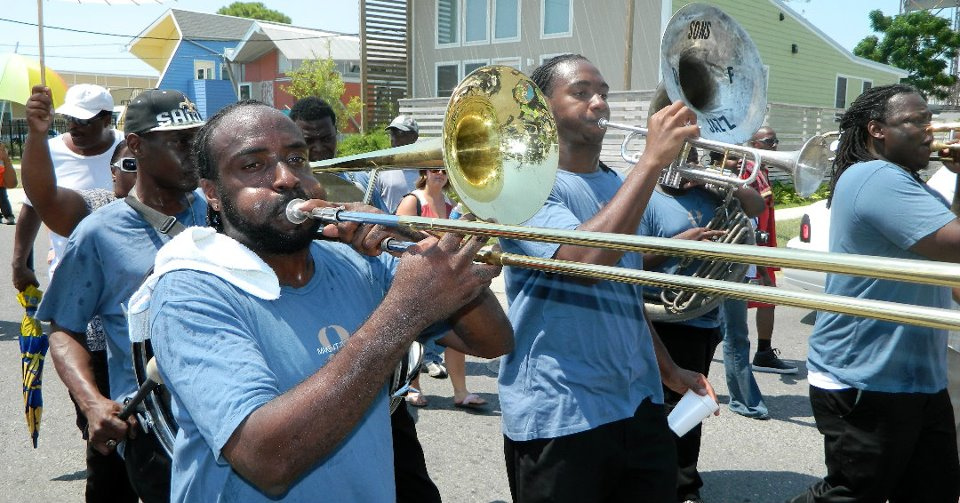
The width and height of the screenshot is (960, 503). Find the location of `white styrofoam cup`. white styrofoam cup is located at coordinates (683, 414).